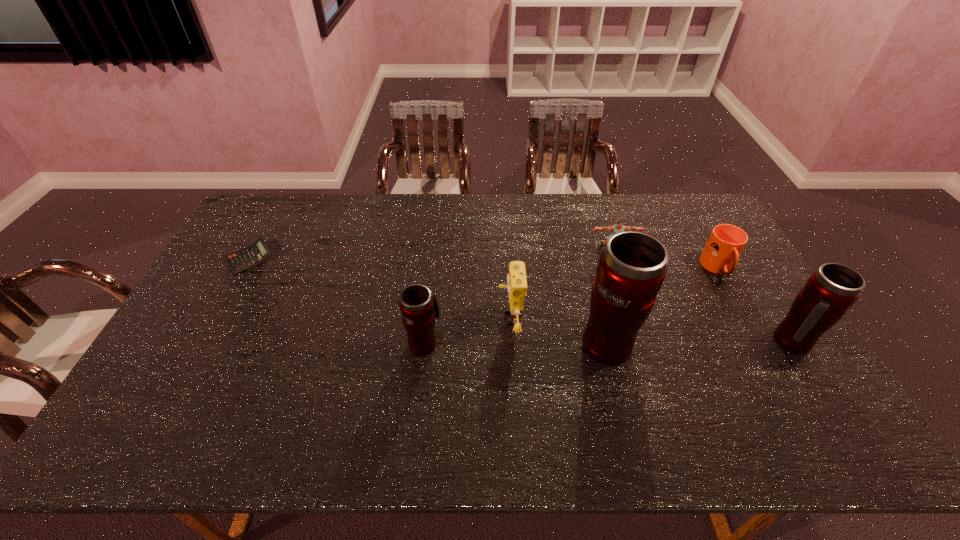
All thermos bottles are currently evenly spaced. To continue this pattern, where would you add another thermos bottle on the left? Please point out a vacant spot. Please provide its 2D coordinates. Your answer should be formatted as a tuple, i.e. [(x, y)], where the tuple contains the x and y coordinates of a point satisfying the conditions above.

[(240, 343)]